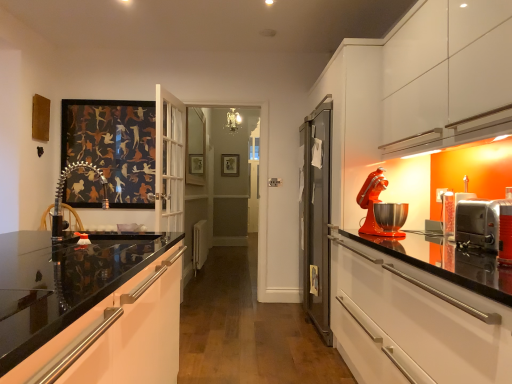
Question: Should I look upward or downward to see matte orange mixer at right?

Choices:
 (A) down
 (B) up

Answer: (A)

Question: Is stainless steel toaster oven at right, the 1th appliance in the front-to-back sequence, turned away from metallic silver toaster at right, marked as the first appliance in a back-to-front arrangement?

Choices:
 (A) no
 (B) yes

Answer: (A)

Question: Is stainless steel toaster oven at right, acting as the 2th appliance starting from the back, aimed at metallic silver toaster at right, marked as the first appliance in a back-to-front arrangement?

Choices:
 (A) no
 (B) yes

Answer: (A)

Question: Can you confirm if stainless steel toaster oven at right, the 1th appliance in the front-to-back sequence, is shorter than metallic silver toaster at right, marked as the first appliance in a back-to-front arrangement?

Choices:
 (A) yes
 (B) no

Answer: (A)

Question: From a real-world perspective, is stainless steel toaster oven at right, acting as the 2th appliance starting from the back, beneath metallic silver toaster at right, marked as the first appliance in a back-to-front arrangement?

Choices:
 (A) no
 (B) yes

Answer: (B)

Question: Is stainless steel toaster oven at right, acting as the 2th appliance starting from the back, further to the viewer compared to metallic silver toaster at right, marked as the first appliance in a back-to-front arrangement?

Choices:
 (A) yes
 (B) no

Answer: (B)

Question: Is stainless steel toaster oven at right, the 1th appliance in the front-to-back sequence, positioned beyond the bounds of metallic silver toaster at right, marked as the first appliance in a back-to-front arrangement?

Choices:
 (A) yes
 (B) no

Answer: (A)

Question: Considering the relative sizes of gold metallic picture frame at center and metallic silver chair at left in the image provided, is gold metallic picture frame at center shorter than metallic silver chair at left?

Choices:
 (A) yes
 (B) no

Answer: (B)

Question: Is gold metallic picture frame at center at the right side of metallic silver chair at left?

Choices:
 (A) yes
 (B) no

Answer: (A)

Question: Is gold metallic picture frame at center at the left side of metallic silver chair at left?

Choices:
 (A) yes
 (B) no

Answer: (B)

Question: Is gold metallic picture frame at center not inside metallic silver chair at left?

Choices:
 (A) no
 (B) yes

Answer: (B)

Question: Is gold metallic picture frame at center far away from metallic silver chair at left?

Choices:
 (A) no
 (B) yes

Answer: (B)

Question: Considering the relative sizes of gold metallic picture frame at center and metallic silver chair at left in the image provided, is gold metallic picture frame at center taller than metallic silver chair at left?

Choices:
 (A) no
 (B) yes

Answer: (B)

Question: Are glossy white cabinet at lower left and metallic silver chair at left located far from each other?

Choices:
 (A) no
 (B) yes

Answer: (B)